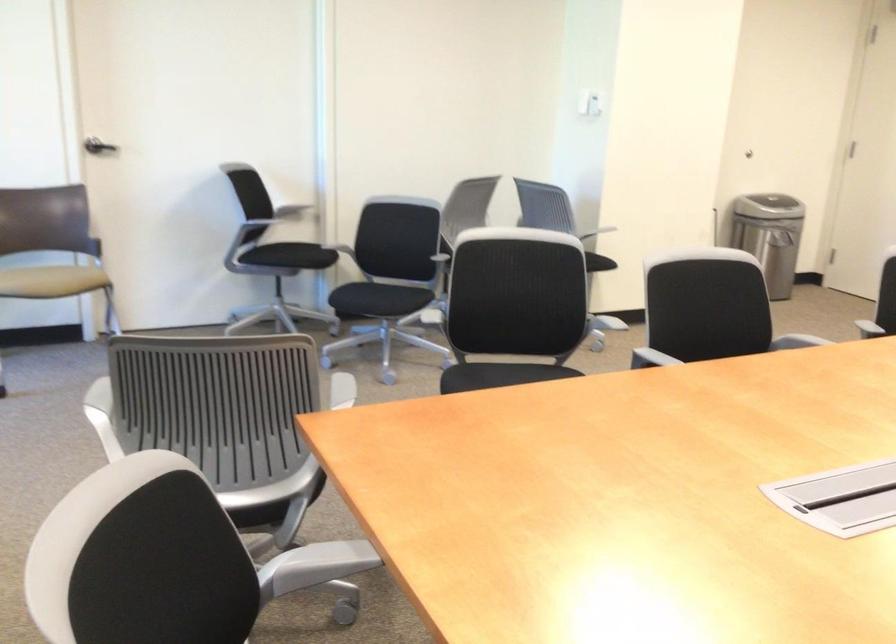
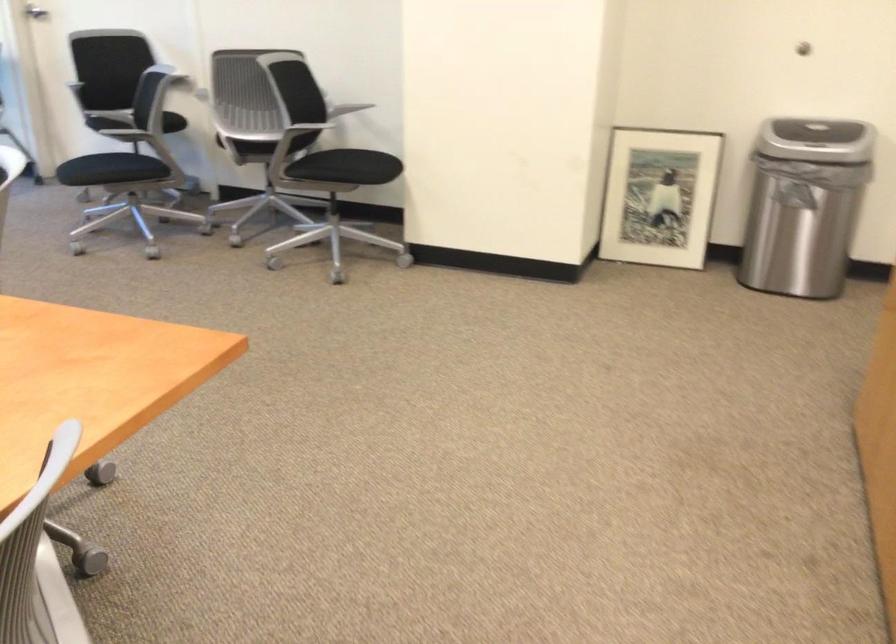
Find the pixel in the second image that matches the point at 779,181 in the first image.

(821, 131)